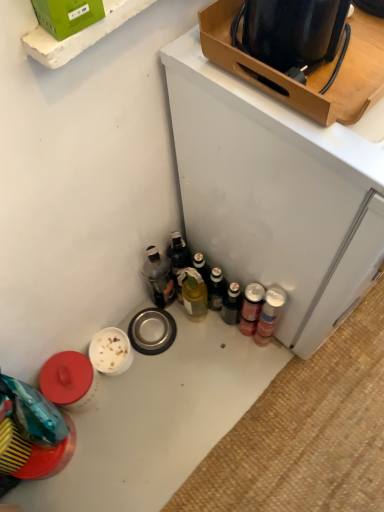
Question: Is white glossy table at lower left thinner than metallic silver canisters at lower right?

Choices:
 (A) yes
 (B) no

Answer: (B)

Question: Is white glossy table at lower left aimed at metallic silver canisters at lower right?

Choices:
 (A) yes
 (B) no

Answer: (B)

Question: Would you say white glossy table at lower left contains metallic silver canisters at lower right?

Choices:
 (A) no
 (B) yes

Answer: (A)

Question: From a real-world perspective, is white glossy table at lower left positioned under metallic silver canisters at lower right based on gravity?

Choices:
 (A) no
 (B) yes

Answer: (B)

Question: Is the surface of white glossy table at lower left in direct contact with metallic silver canisters at lower right?

Choices:
 (A) yes
 (B) no

Answer: (B)

Question: From the image's perspective, is translucent glass bottle at center, which is the 3th bottle from left to right, positioned above or below translucent glass bottle at center, marked as the 1th bottle in a left-to-right arrangement?

Choices:
 (A) below
 (B) above

Answer: (A)

Question: Is point (200, 315) closer or farther from the camera than point (160, 266)?

Choices:
 (A) farther
 (B) closer

Answer: (A)

Question: In terms of size, does translucent glass bottle at center, the second bottle when ordered from right to left, appear bigger or smaller than translucent glass bottle at center, marked as the 1th bottle in a left-to-right arrangement?

Choices:
 (A) small
 (B) big

Answer: (A)

Question: In the image, is translucent glass bottle at center, which is the 3th bottle from left to right, on the left side or the right side of translucent glass bottle at center, marked as the 1th bottle in a left-to-right arrangement?

Choices:
 (A) right
 (B) left

Answer: (A)

Question: Relative to green cardboard box at upper left, placed as the 2th box when sorted from back to front, is metallic silver can at lower right, the 4th bottle in the left-to-right sequence, in front or behind?

Choices:
 (A) front
 (B) behind

Answer: (B)

Question: In terms of height, does metallic silver can at lower right, which ranks as the 1th bottle in right-to-left order, look taller or shorter compared to green cardboard box at upper left, which is counted as the first box, starting from the front?

Choices:
 (A) short
 (B) tall

Answer: (B)

Question: Is metallic silver can at lower right, the 4th bottle in the left-to-right sequence, inside the boundaries of green cardboard box at upper left, which is counted as the first box, starting from the front, or outside?

Choices:
 (A) inside
 (B) outside

Answer: (B)

Question: From the image's perspective, relative to green cardboard box at upper left, acting as the second box starting from the right, is metallic silver can at lower right, the 4th bottle in the left-to-right sequence, above or below?

Choices:
 (A) above
 (B) below

Answer: (B)

Question: Is point (193, 315) positioned closer to the camera than point (253, 300)?

Choices:
 (A) farther
 (B) closer

Answer: (A)

Question: In terms of height, does translucent glass bottle at center, which is the 3th bottle from left to right, look taller or shorter compared to metallic silver can at lower right?

Choices:
 (A) short
 (B) tall

Answer: (B)